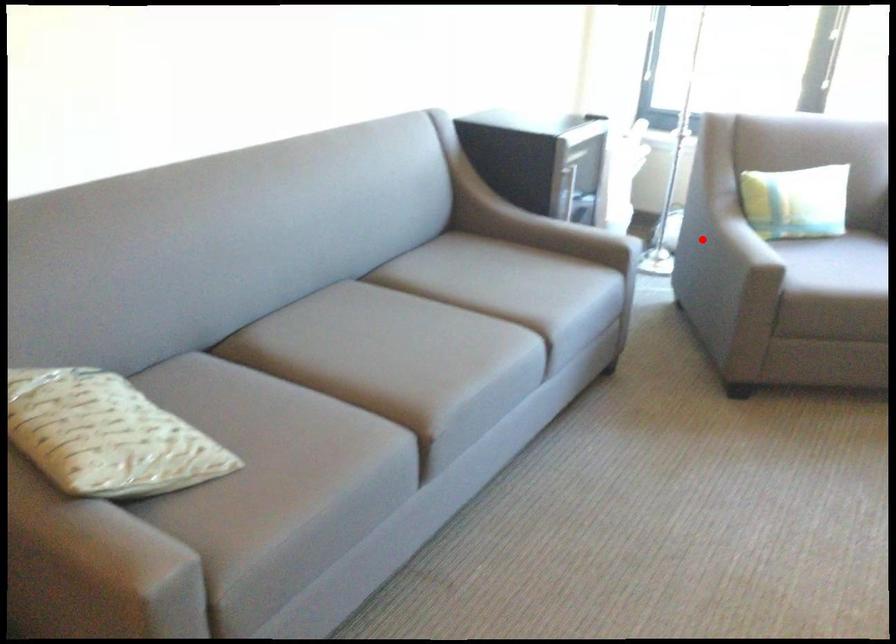
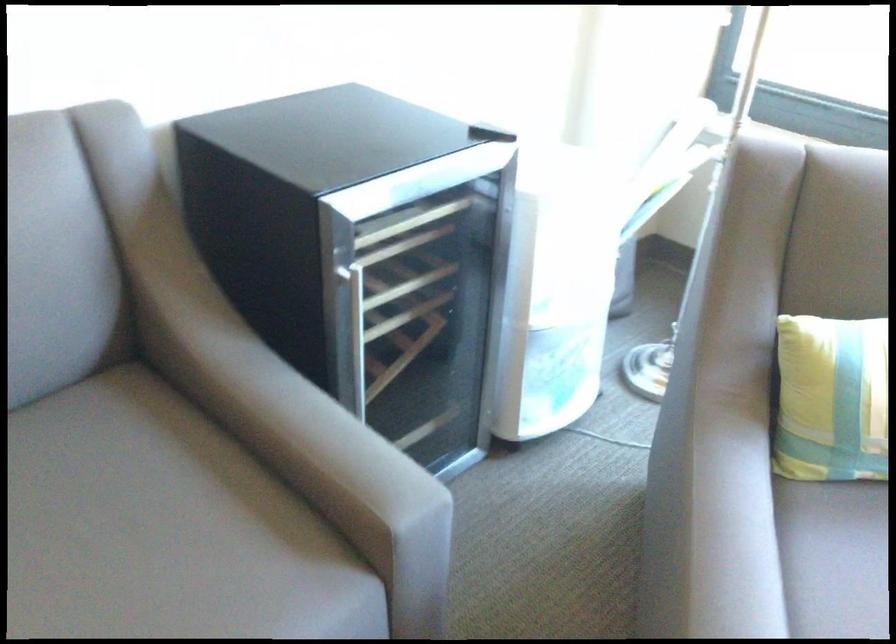
Question: I am providing you with two images of the same scene from different viewpoints. Image1 has a red point marked. In image2, the corresponding 3D location appears at what relative position? Reply with the corresponding letter.

Choices:
 (A) Closer
 (B) Farther

Answer: (A)